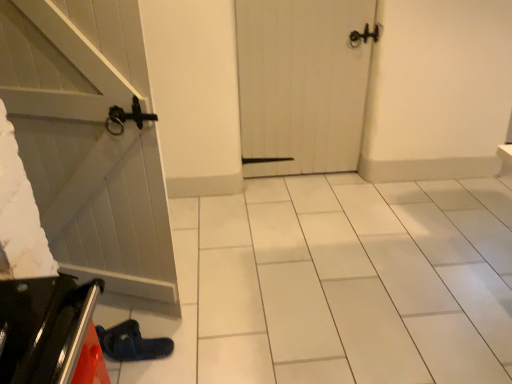
Question: Does white wooden door at center have a lesser height compared to blue suede slipper at lower left?

Choices:
 (A) no
 (B) yes

Answer: (A)

Question: Considering the relative sizes of white wooden door at center and blue suede slipper at lower left in the image provided, is white wooden door at center bigger than blue suede slipper at lower left?

Choices:
 (A) no
 (B) yes

Answer: (B)

Question: Does white wooden door at center contain blue suede slipper at lower left?

Choices:
 (A) no
 (B) yes

Answer: (A)

Question: From a real-world perspective, is white wooden door at center beneath blue suede slipper at lower left?

Choices:
 (A) yes
 (B) no

Answer: (B)

Question: Does white wooden door at center have a greater width compared to blue suede slipper at lower left?

Choices:
 (A) yes
 (B) no

Answer: (B)

Question: In terms of size, does white wooden door at center appear bigger or smaller than blue suede slipper at lower left?

Choices:
 (A) small
 (B) big

Answer: (B)

Question: Visually, is white wooden door at center positioned to the left or to the right of blue suede slipper at lower left?

Choices:
 (A) right
 (B) left

Answer: (A)

Question: Looking at their shapes, would you say white wooden door at center is wider or thinner than blue suede slipper at lower left?

Choices:
 (A) thin
 (B) wide

Answer: (A)

Question: Considering the positions of point (301, 89) and point (110, 344), is point (301, 89) closer or farther from the camera than point (110, 344)?

Choices:
 (A) farther
 (B) closer

Answer: (A)

Question: Is blue suede slipper at lower left wider or thinner than shiny metallic oven at lower left?

Choices:
 (A) wide
 (B) thin

Answer: (A)

Question: From the image's perspective, is blue suede slipper at lower left above or below shiny metallic oven at lower left?

Choices:
 (A) above
 (B) below

Answer: (B)

Question: Considering the positions of blue suede slipper at lower left and shiny metallic oven at lower left in the image, is blue suede slipper at lower left bigger or smaller than shiny metallic oven at lower left?

Choices:
 (A) big
 (B) small

Answer: (B)

Question: Does point (141, 360) appear closer or farther from the camera than point (0, 294)?

Choices:
 (A) farther
 (B) closer

Answer: (A)

Question: Which is correct: shiny metallic oven at lower left is inside blue suede slipper at lower left, or outside of it?

Choices:
 (A) outside
 (B) inside

Answer: (A)

Question: Does point (87, 349) appear closer or farther from the camera than point (123, 324)?

Choices:
 (A) closer
 (B) farther

Answer: (A)